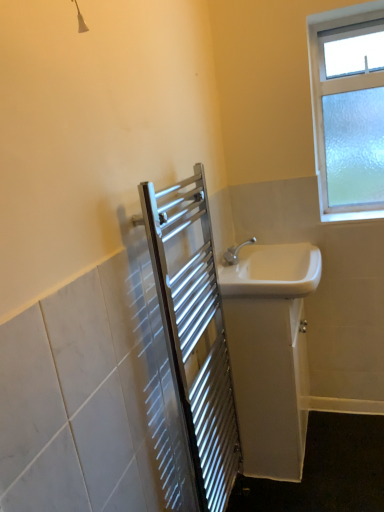
Locate an element on the screen. frosted glass window at upper right is located at coordinates (348, 110).

In order to face white glossy sink at right, arranged as the first sink when viewed from the top, should I rotate leftwards or rightwards?

You should look right and rotate roughly 10.401 degrees.

Image resolution: width=384 pixels, height=512 pixels. What are the coordinates of `white glossy sink at right, the 2th sink from the top` in the screenshot? It's located at (270, 353).

Is point (207, 422) closer or farther from the camera than point (328, 61)?

Point (207, 422).

In the image, is polished stainless steel towel rack at center-left positioned in front of or behind frosted glass window at upper right?

polished stainless steel towel rack at center-left is positioned closer to the viewer than frosted glass window at upper right.

Would you say polished stainless steel towel rack at center-left is a long distance from frosted glass window at upper right?

No, there isn't a large distance between polished stainless steel towel rack at center-left and frosted glass window at upper right.

Between polished stainless steel towel rack at center-left and frosted glass window at upper right, which one appears on the right side from the viewer's perspective?

Positioned to the right is frosted glass window at upper right.

Does frosted glass window at upper right appear on the left side of white glossy sink at right, arranged as the first sink when viewed from the top?

In fact, frosted glass window at upper right is to the right of white glossy sink at right, arranged as the first sink when viewed from the top.

Consider the image. From the image's perspective, relative to white glossy sink at right, arranged as the first sink when viewed from the top, is frosted glass window at upper right above or below?

From the image's perspective, frosted glass window at upper right appears above white glossy sink at right, arranged as the first sink when viewed from the top.

Which is in front, point (358, 65) or point (308, 282)?

The point (308, 282) is closer to the camera.

Between frosted glass window at upper right and white glossy sink at right, arranged as the second sink when ordered from the bottom, which one has larger width?

white glossy sink at right, arranged as the second sink when ordered from the bottom, is wider.

Does white glossy sink at right, the 2th sink from the top, turn towards frosted glass window at upper right?

No, white glossy sink at right, the 2th sink from the top, is not oriented towards frosted glass window at upper right.

Which is nearer, (303, 436) or (371, 53)?

The point (303, 436) is in front.

From the frosted glass window at upper right, count 1st sinks forward and point to it. Please provide its 2D coordinates.

[(270, 353)]

Does white glossy sink at right, the 2th sink from the top, have a greater height compared to frosted glass window at upper right?

No, white glossy sink at right, the 2th sink from the top, is not taller than frosted glass window at upper right.

Considering the sizes of objects frosted glass window at upper right and polished stainless steel towel rack at center-left in the image provided, who is bigger, frosted glass window at upper right or polished stainless steel towel rack at center-left?

With larger size is polished stainless steel towel rack at center-left.

Can you confirm if frosted glass window at upper right is thinner than polished stainless steel towel rack at center-left?

No, frosted glass window at upper right is not thinner than polished stainless steel towel rack at center-left.

Where is `window that appears on the right of polished stainless steel towel rack at center-left`? This screenshot has height=512, width=384. window that appears on the right of polished stainless steel towel rack at center-left is located at coordinates [348, 110].

Does frosted glass window at upper right appear on the right side of polished stainless steel towel rack at center-left?

Yes, frosted glass window at upper right is to the right of polished stainless steel towel rack at center-left.

Looking at this image, considering the sizes of white glossy sink at right, the first sink in the bottom-to-top sequence, and polished stainless steel towel rack at center-left in the image, is white glossy sink at right, the first sink in the bottom-to-top sequence, wider or thinner than polished stainless steel towel rack at center-left?

white glossy sink at right, the first sink in the bottom-to-top sequence, is wider than polished stainless steel towel rack at center-left.

From the image's perspective, is white glossy sink at right, the 2th sink from the top, over polished stainless steel towel rack at center-left?

No.

From a real-world perspective, who is located higher, white glossy sink at right, the first sink in the bottom-to-top sequence, or polished stainless steel towel rack at center-left?

From a 3D spatial view, polished stainless steel towel rack at center-left is above.

Considering the positions of points (244, 283) and (252, 396), is point (244, 283) farther from camera compared to point (252, 396)?

No.

From the image's perspective, which one is positioned lower, white glossy sink at right, arranged as the second sink when ordered from the bottom, or white glossy sink at right, the 2th sink from the top?

white glossy sink at right, the 2th sink from the top, from the image's perspective.

Between white glossy sink at right, arranged as the second sink when ordered from the bottom, and white glossy sink at right, the first sink in the bottom-to-top sequence, which one has less height?

white glossy sink at right, arranged as the second sink when ordered from the bottom, is shorter.

From a real-world perspective, is white glossy sink at right, arranged as the second sink when ordered from the bottom, on top of white glossy sink at right, the 2th sink from the top?

Indeed, from a real-world perspective, white glossy sink at right, arranged as the second sink when ordered from the bottom, stands above white glossy sink at right, the 2th sink from the top.

Between polished stainless steel towel rack at center-left and white glossy sink at right, arranged as the first sink when viewed from the top, which one appears on the right side from the viewer's perspective?

white glossy sink at right, arranged as the first sink when viewed from the top.

Choose the correct answer: Is polished stainless steel towel rack at center-left inside white glossy sink at right, arranged as the second sink when ordered from the bottom, or outside it?

polished stainless steel towel rack at center-left is located beyond the bounds of white glossy sink at right, arranged as the second sink when ordered from the bottom.

Which is behind, point (189, 186) or point (286, 295)?

Point (286, 295)

In the scene shown: Considering the sizes of polished stainless steel towel rack at center-left and white glossy sink at right, arranged as the second sink when ordered from the bottom, in the image, is polished stainless steel towel rack at center-left bigger or smaller than white glossy sink at right, arranged as the second sink when ordered from the bottom,?

In the image, polished stainless steel towel rack at center-left appears to be larger than white glossy sink at right, arranged as the second sink when ordered from the bottom.

The image size is (384, 512). What are the coordinates of `screen door directly beneath the frosted glass window at upper right (from a real-world perspective)` in the screenshot? It's located at (195, 332).

The image size is (384, 512). I want to click on the 2nd sink counting from the left side of the frosted glass window at upper right, so click(272, 271).

Based on their spatial positions, is frosted glass window at upper right or white glossy sink at right, arranged as the first sink when viewed from the top, closer to polished stainless steel towel rack at center-left?

Based on the image, white glossy sink at right, arranged as the first sink when viewed from the top, appears to be nearer to polished stainless steel towel rack at center-left.

Considering their positions, is white glossy sink at right, arranged as the first sink when viewed from the top, positioned closer to frosted glass window at upper right than polished stainless steel towel rack at center-left?

Among the two, white glossy sink at right, arranged as the first sink when viewed from the top, is located nearer to frosted glass window at upper right.

Based on their spatial positions, is frosted glass window at upper right or polished stainless steel towel rack at center-left closer to white glossy sink at right, the 2th sink from the top?

polished stainless steel towel rack at center-left is closer to white glossy sink at right, the 2th sink from the top.

From the image, which object appears to be nearer to white glossy sink at right, the first sink in the bottom-to-top sequence, polished stainless steel towel rack at center-left or frosted glass window at upper right?

polished stainless steel towel rack at center-left is positioned closer to the anchor white glossy sink at right, the first sink in the bottom-to-top sequence.

From the image, which object appears to be nearer to frosted glass window at upper right, white glossy sink at right, arranged as the first sink when viewed from the top, or white glossy sink at right, the first sink in the bottom-to-top sequence?

The object closer to frosted glass window at upper right is white glossy sink at right, arranged as the first sink when viewed from the top.

From the image, which object appears to be nearer to frosted glass window at upper right, white glossy sink at right, the first sink in the bottom-to-top sequence, or white glossy sink at right, arranged as the second sink when ordered from the bottom?

white glossy sink at right, arranged as the second sink when ordered from the bottom, is positioned closer to the anchor frosted glass window at upper right.

Looking at the image, which one is located further to white glossy sink at right, the 2th sink from the top, polished stainless steel towel rack at center-left or white glossy sink at right, arranged as the second sink when ordered from the bottom?

polished stainless steel towel rack at center-left lies further to white glossy sink at right, the 2th sink from the top, than the other object.

Based on their spatial positions, is white glossy sink at right, the 2th sink from the top, or polished stainless steel towel rack at center-left closer to white glossy sink at right, arranged as the first sink when viewed from the top?

The object closer to white glossy sink at right, arranged as the first sink when viewed from the top, is white glossy sink at right, the 2th sink from the top.

Locate an element on the screen. The image size is (384, 512). sink that lies between frosted glass window at upper right and white glossy sink at right, the first sink in the bottom-to-top sequence, from top to bottom is located at coordinates (272, 271).

You are a GUI agent. You are given a task and a screenshot of the screen. Output one action in this format:
    pyautogui.click(x=<x>, y=<y>)
    Task: Click on the screen door between frosted glass window at upper right and white glossy sink at right, the 2th sink from the top, from top to bottom
    This screenshot has height=512, width=384.
    Given the screenshot: What is the action you would take?
    pyautogui.click(x=195, y=332)

The height and width of the screenshot is (512, 384). In order to click on sink located between polished stainless steel towel rack at center-left and white glossy sink at right, the first sink in the bottom-to-top sequence, in the depth direction in this screenshot , I will do (x=272, y=271).

The width and height of the screenshot is (384, 512). I want to click on sink that lies between frosted glass window at upper right and polished stainless steel towel rack at center-left from top to bottom, so click(272, 271).